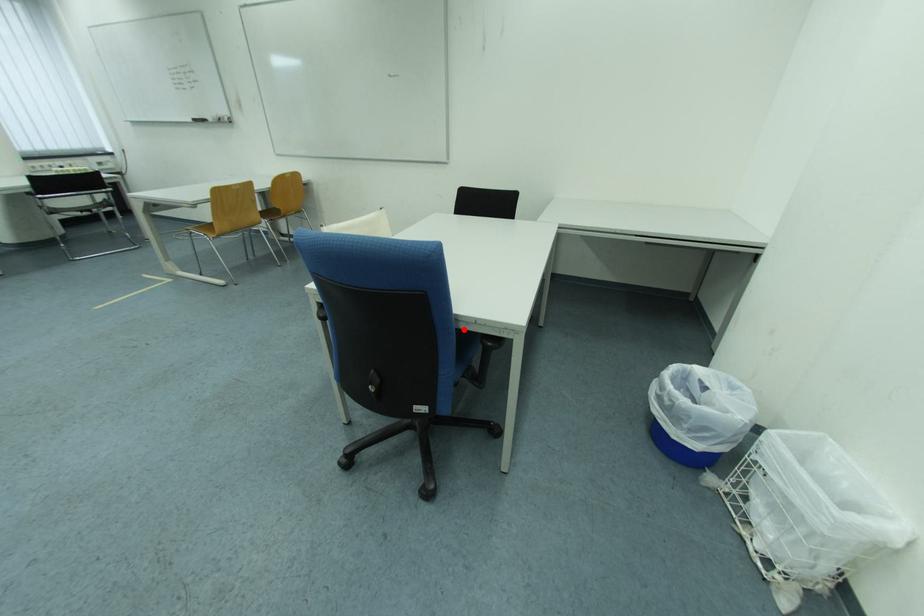
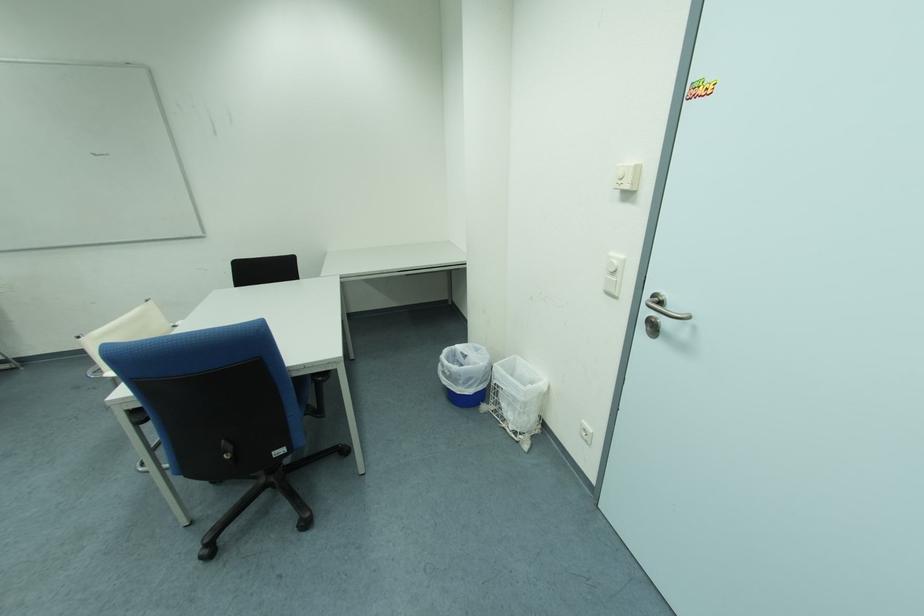
The point at the highlighted location is marked in the first image. Where is the corresponding point in the second image?

(298, 379)